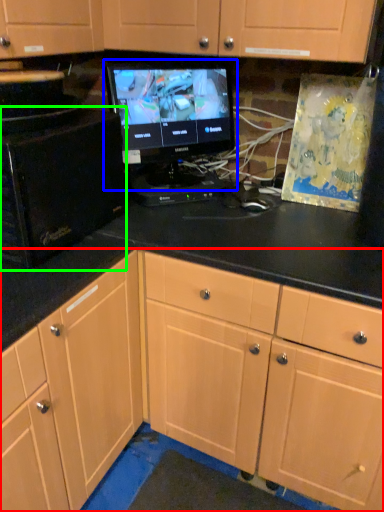
Question: Considering the real-world distances, which object is farthest from cabinetry (highlighted by a red box)? computer monitor (highlighted by a blue box) or desktop computer (highlighted by a green box)?

Choices:
 (A) computer monitor
 (B) desktop computer

Answer: (A)